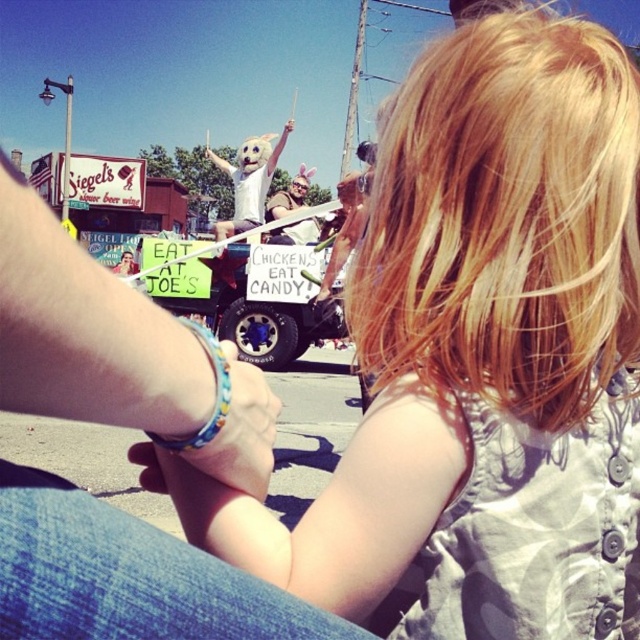
Is multicolored beaded bracelet at lower center shorter than matte brown leather jacket at center?

Yes.

Is point (260, 452) in front of point (289, 205)?

That is True.

Is point (262, 388) positioned in front of point (289, 209)?

Yes.

Locate an element on the screen. This screenshot has height=640, width=640. multicolored beaded bracelet at lower center is located at coordinates (241, 433).

The height and width of the screenshot is (640, 640). Describe the element at coordinates (214, 394) in the screenshot. I see `multicolored beaded bracelet on the wrist` at that location.

Does multicolored beaded bracelet on the wrist have a greater height compared to matte brown leather jacket at center?

In fact, multicolored beaded bracelet on the wrist may be shorter than matte brown leather jacket at center.

Image resolution: width=640 pixels, height=640 pixels. What do you see at coordinates (214, 394) in the screenshot?
I see `multicolored beaded bracelet on the wrist` at bounding box center [214, 394].

I want to click on multicolored beaded bracelet on the wrist, so click(214, 394).

Is point (460, 348) behind point (196, 333)?

Yes.

Based on the photo, is blonde hair at upper center smaller than multicolored beaded bracelet on the wrist?

Incorrect, blonde hair at upper center is not smaller in size than multicolored beaded bracelet on the wrist.

Which is behind, point (500, 54) or point (180, 436)?

The point (500, 54) is more distant.

Locate an element on the screen. blonde hair at upper center is located at coordinates (506, 220).